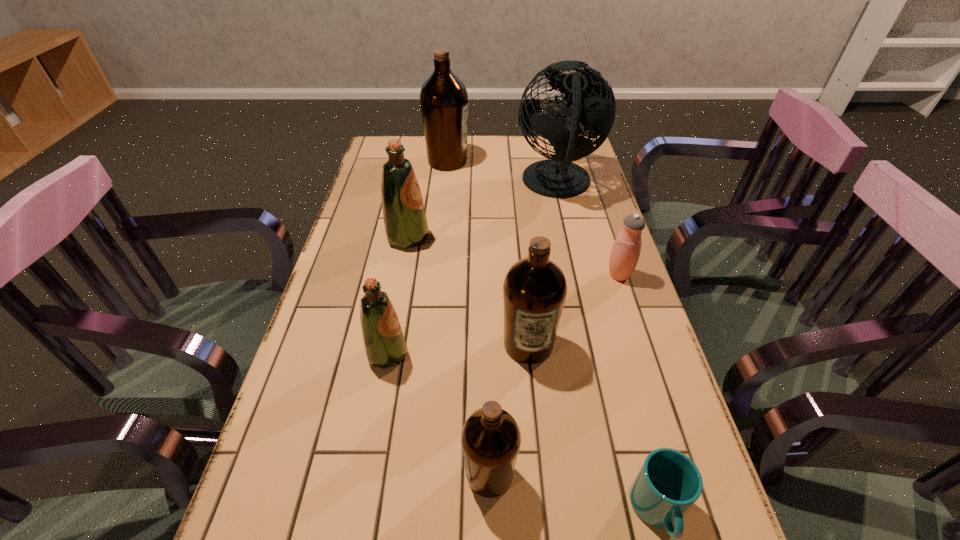
Where is `globe`? The height and width of the screenshot is (540, 960). globe is located at coordinates (593, 101).

Where is `the leftmost brown olive oil`? the leftmost brown olive oil is located at coordinates (444, 100).

This screenshot has width=960, height=540. I want to click on the biggest brown olive oil, so click(444, 100).

Where is `the bigger green olive oil`? the bigger green olive oil is located at coordinates (405, 223).

Locate an element on the screen. This screenshot has width=960, height=540. the fourth nearest olive oil is located at coordinates (405, 223).

The width and height of the screenshot is (960, 540). Find the location of `the second biggest brown olive oil`. the second biggest brown olive oil is located at coordinates (534, 290).

Locate an element on the screen. the nearer green olive oil is located at coordinates (384, 342).

Where is `the nearest olive oil`? The height and width of the screenshot is (540, 960). the nearest olive oil is located at coordinates (x=490, y=438).

At what (x,y) coordinates should I click in order to perform the action: click on the nearest brown olive oil. Please return your answer as a coordinate pair (x, y). Looking at the image, I should click on (490, 438).

What are the coordinates of `thermos bottle` in the screenshot? It's located at (625, 252).